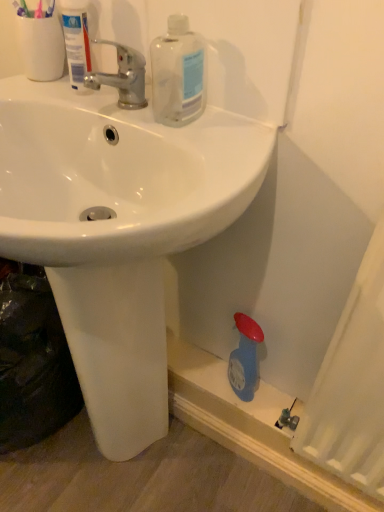
Where is `free point to the left of chrome metallic faucet at upper center`? free point to the left of chrome metallic faucet at upper center is located at coordinates (51, 97).